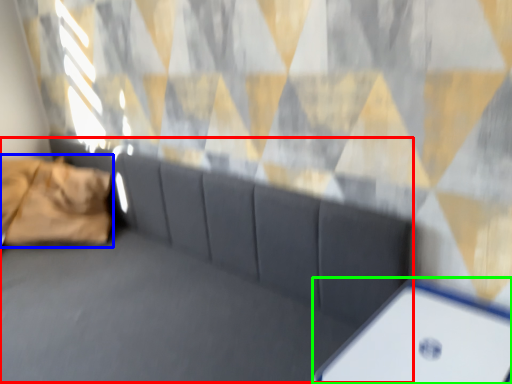
Question: Estimate the real-world distances between objects in this image. Which object is closer to couch (highlighted by a red box), pillow (highlighted by a blue box) or furniture (highlighted by a green box)?

Choices:
 (A) pillow
 (B) furniture

Answer: (B)